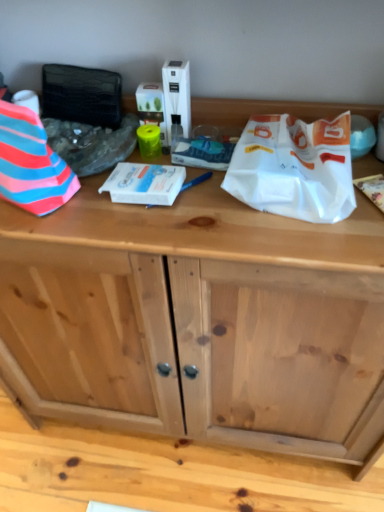
Question: Does striped fabric at left, which is the 1th wrapping paper in left-to-right order, have a lesser height compared to white paper bag at upper right, which appears as the first wrapping paper when viewed from the right?

Choices:
 (A) no
 (B) yes

Answer: (A)

Question: Is striped fabric at left, which is the 1th wrapping paper in left-to-right order, smaller than white paper bag at upper right, which appears as the first wrapping paper when viewed from the right?

Choices:
 (A) yes
 (B) no

Answer: (B)

Question: Does striped fabric at left, which is the 1th wrapping paper in left-to-right order, have a larger size compared to white paper bag at upper right, the 3th wrapping paper positioned from the left?

Choices:
 (A) no
 (B) yes

Answer: (B)

Question: Is striped fabric at left, arranged as the third wrapping paper when viewed from the right, taller than white paper bag at upper right, which appears as the first wrapping paper when viewed from the right?

Choices:
 (A) yes
 (B) no

Answer: (A)

Question: Considering the relative sizes of striped fabric at left, which is the 1th wrapping paper in left-to-right order, and white paper bag at upper right, the 3th wrapping paper positioned from the left, in the image provided, is striped fabric at left, which is the 1th wrapping paper in left-to-right order, thinner than white paper bag at upper right, the 3th wrapping paper positioned from the left,?

Choices:
 (A) no
 (B) yes

Answer: (B)

Question: Is striped fabric at left, which is the 1th wrapping paper in left-to-right order, aimed at white paper bag at upper right, the 3th wrapping paper positioned from the left?

Choices:
 (A) no
 (B) yes

Answer: (A)

Question: From the image's perspective, is striped fabric at left, which is the 1th wrapping paper in left-to-right order, over white glossy box at center, the second wrapping paper positioned from the left?

Choices:
 (A) yes
 (B) no

Answer: (A)

Question: Does striped fabric at left, which is the 1th wrapping paper in left-to-right order, have a lesser width compared to white glossy box at center, positioned as the 2th wrapping paper in right-to-left order?

Choices:
 (A) no
 (B) yes

Answer: (A)

Question: Is striped fabric at left, which is the 1th wrapping paper in left-to-right order, positioned with its back to white glossy box at center, the second wrapping paper positioned from the left?

Choices:
 (A) no
 (B) yes

Answer: (A)

Question: Considering the relative sizes of striped fabric at left, arranged as the third wrapping paper when viewed from the right, and white glossy box at center, positioned as the 2th wrapping paper in right-to-left order, in the image provided, is striped fabric at left, arranged as the third wrapping paper when viewed from the right, smaller than white glossy box at center, positioned as the 2th wrapping paper in right-to-left order,?

Choices:
 (A) no
 (B) yes

Answer: (A)

Question: Does striped fabric at left, arranged as the third wrapping paper when viewed from the right, come behind white glossy box at center, positioned as the 2th wrapping paper in right-to-left order?

Choices:
 (A) yes
 (B) no

Answer: (B)

Question: Can you confirm if striped fabric at left, arranged as the third wrapping paper when viewed from the right, is taller than white glossy box at center, the second wrapping paper positioned from the left?

Choices:
 (A) yes
 (B) no

Answer: (A)

Question: Does white glossy box at center, positioned as the 2th wrapping paper in right-to-left order, lie behind striped fabric at left, arranged as the third wrapping paper when viewed from the right?

Choices:
 (A) no
 (B) yes

Answer: (B)